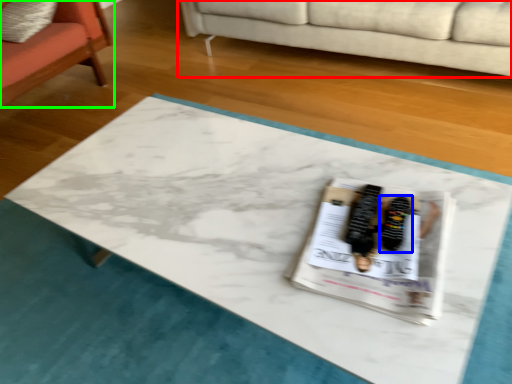
Question: Based on their relative distances, which object is nearer to studio couch (highlighted by a red box)? Choose from footwear (highlighted by a blue box) and chair (highlighted by a green box).

Choices:
 (A) footwear
 (B) chair

Answer: (B)